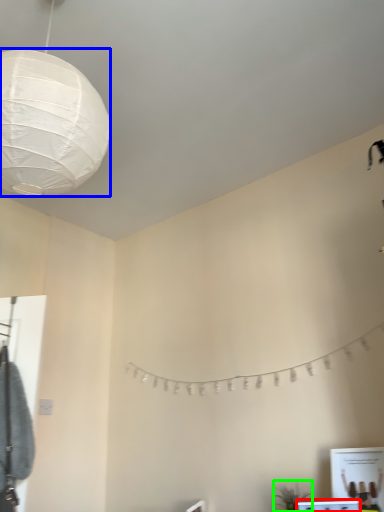
Question: Based on their relative distances, which object is farther from vanity (highlighted by a red box)? Choose from lantern (highlighted by a blue box) and plant (highlighted by a green box).

Choices:
 (A) lantern
 (B) plant

Answer: (A)